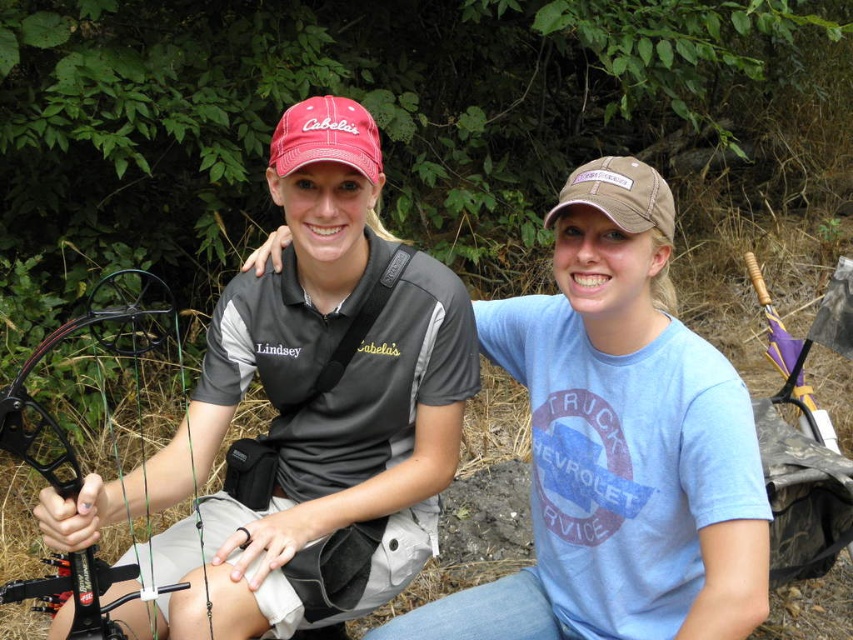
Question: Which point is closer to the camera?

Choices:
 (A) (515, 616)
 (B) (326, 356)
 (C) (178, 340)

Answer: (A)

Question: Considering the relative positions of light blue cotton t-shirt at center and black composite bow at left in the image provided, where is light blue cotton t-shirt at center located with respect to black composite bow at left?

Choices:
 (A) right
 (B) left

Answer: (A)

Question: Which is nearer to the black composite bow at left?

Choices:
 (A) light blue cotton t-shirt at center
 (B) matte gray shirt at center

Answer: (B)

Question: Can you confirm if matte gray shirt at center is smaller than light blue cotton t-shirt at center?

Choices:
 (A) no
 (B) yes

Answer: (A)

Question: Can you confirm if matte gray shirt at center is positioned below black composite bow at left?

Choices:
 (A) no
 (B) yes

Answer: (A)

Question: Which is farther from the matte gray shirt at center?

Choices:
 (A) black composite bow at left
 (B) light blue cotton t-shirt at center

Answer: (A)